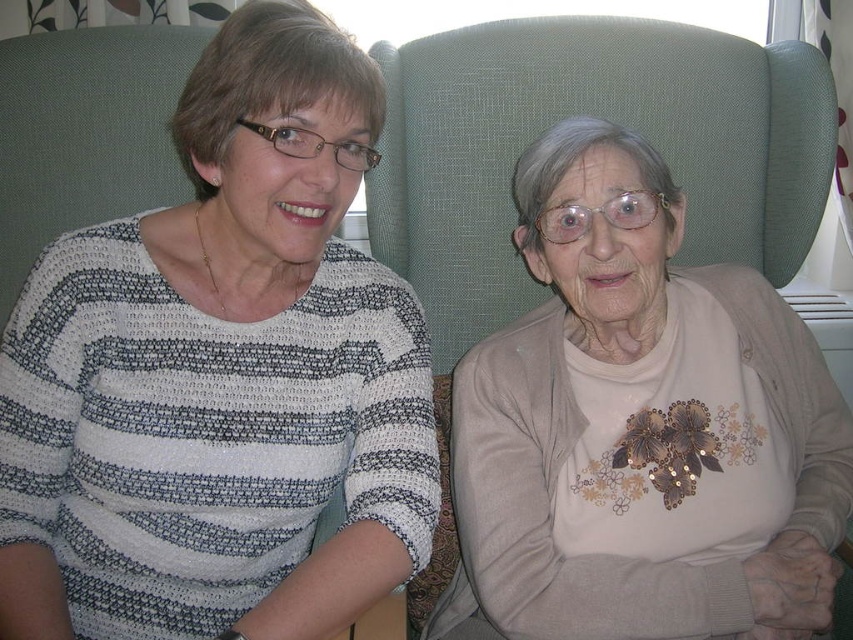
You are organizing a clothing display and need to arrange the matte striped sweater at center and the beige embroidered sweater at center based on their positions in the image. Which sweater should be placed to the left of the other?

The matte striped sweater at center should be placed to the left of the beige embroidered sweater at center because, according to the description, it is positioned on the left side of the beige embroidered sweater at center.

You are a photographer trying to capture a closeup of the matte striped sweater at center without the beige embroidered sweater at center blocking the view. Is this possible given their positions?

The matte striped sweater at center is closer to the viewer than the beige embroidered sweater at center, so it is possible to capture a closeup of the matte striped sweater at center without the beige embroidered sweater at center blocking the view.

You are helping organize a clothing donation drive and need to determine which of the two sweaters, the matte striped sweater at center or the beige embroidered sweater at center, can fit into a standard donation box that can only accommodate items up to the size of the smaller sweater. Which sweater should you choose?

The matte striped sweater at center is smaller than the beige embroidered sweater at center, so you should choose the matte striped sweater at center to fit into the donation box.